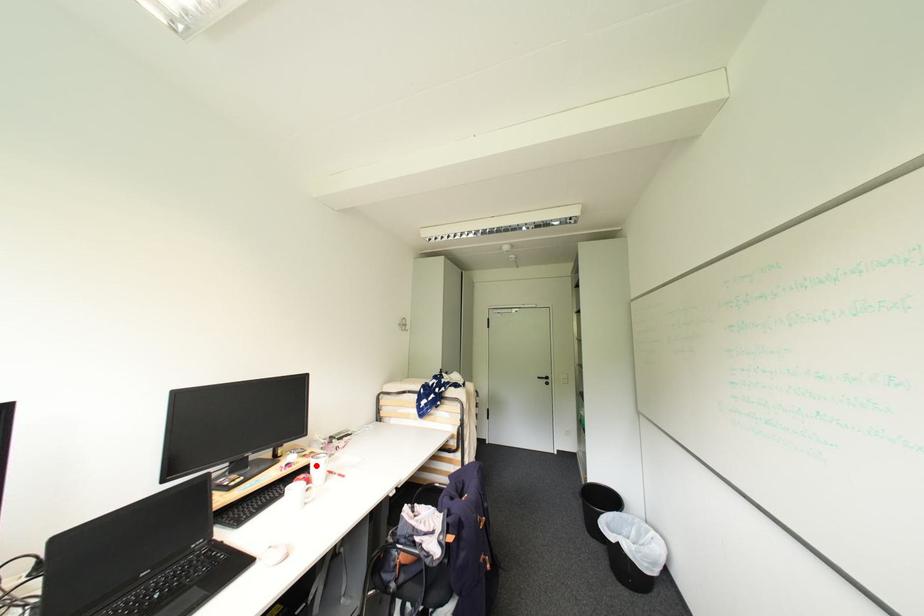
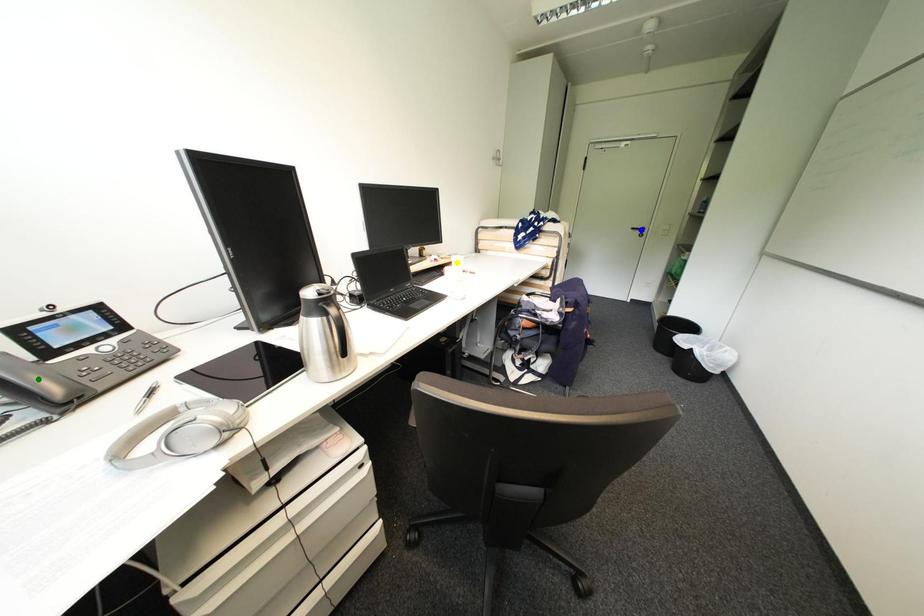
Question: I am providing you with two images of the same scene from different viewpoints. A red point is marked on the first image. You are given multiple points on the second image. Which mark in image 2 goes with the point in image 1?

Choices:
 (A) green point
 (B) blue point
 (C) yellow point

Answer: (C)